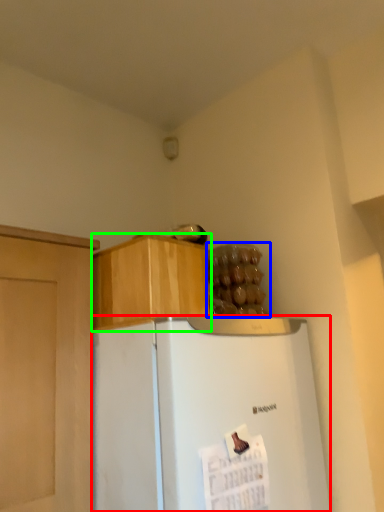
Question: Based on their relative distances, which object is farther from refrigerator (highlighted by a red box)? Choose from food (highlighted by a blue box) and cabinetry (highlighted by a green box).

Choices:
 (A) food
 (B) cabinetry

Answer: (A)